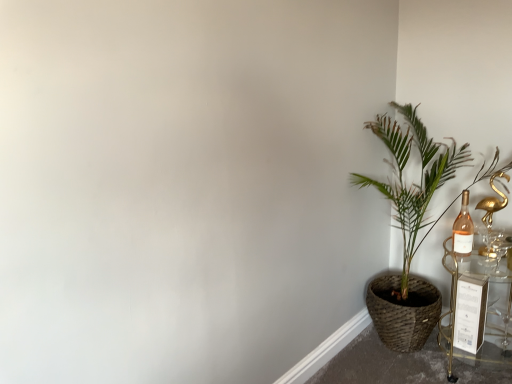
Question: Does green woven basket at right appear on the right side of gold metallic swan at right?

Choices:
 (A) no
 (B) yes

Answer: (A)

Question: Are green woven basket at right and gold metallic swan at right far apart?

Choices:
 (A) no
 (B) yes

Answer: (A)

Question: Is green woven basket at right further to camera compared to gold metallic swan at right?

Choices:
 (A) yes
 (B) no

Answer: (B)

Question: Is green woven basket at right facing away from gold metallic swan at right?

Choices:
 (A) no
 (B) yes

Answer: (B)

Question: Is green woven basket at right next to gold metallic swan at right and touching it?

Choices:
 (A) no
 (B) yes

Answer: (A)

Question: Is green woven basket at right positioned in front of gold metallic swan at right?

Choices:
 (A) no
 (B) yes

Answer: (B)

Question: Is gold metallic swan at right oriented away from pink glass bottle at right?

Choices:
 (A) yes
 (B) no

Answer: (B)

Question: Could you tell me if gold metallic swan at right is turned towards pink glass bottle at right?

Choices:
 (A) yes
 (B) no

Answer: (B)

Question: Is gold metallic swan at right not within pink glass bottle at right?

Choices:
 (A) no
 (B) yes

Answer: (B)

Question: Is gold metallic swan at right next to pink glass bottle at right?

Choices:
 (A) yes
 (B) no

Answer: (B)

Question: From the image's perspective, is gold metallic swan at right located above pink glass bottle at right?

Choices:
 (A) yes
 (B) no

Answer: (A)

Question: From a real-world perspective, does gold metallic swan at right sit lower than pink glass bottle at right?

Choices:
 (A) no
 (B) yes

Answer: (A)

Question: Can you confirm if gold metallic swan at right is shorter than green woven basket at right?

Choices:
 (A) no
 (B) yes

Answer: (B)